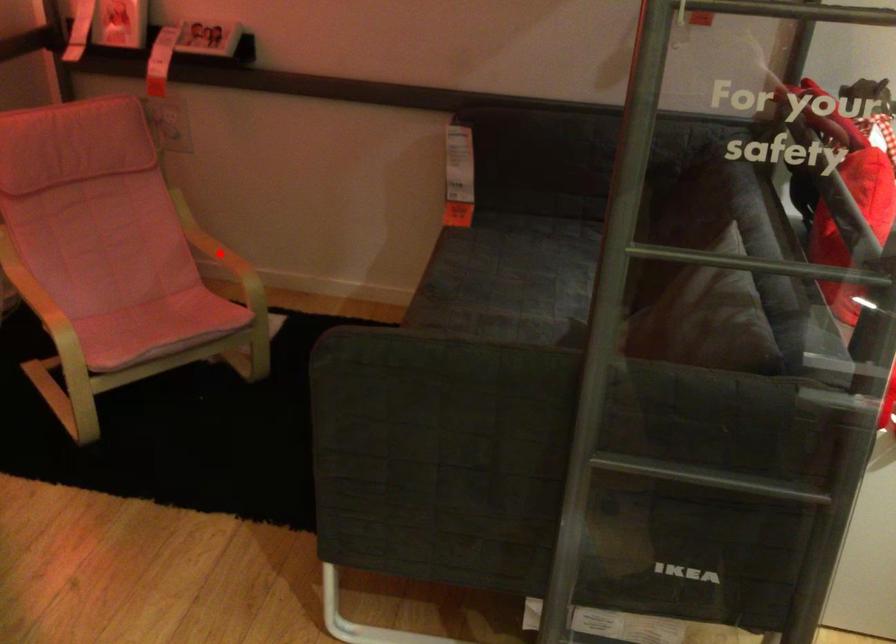
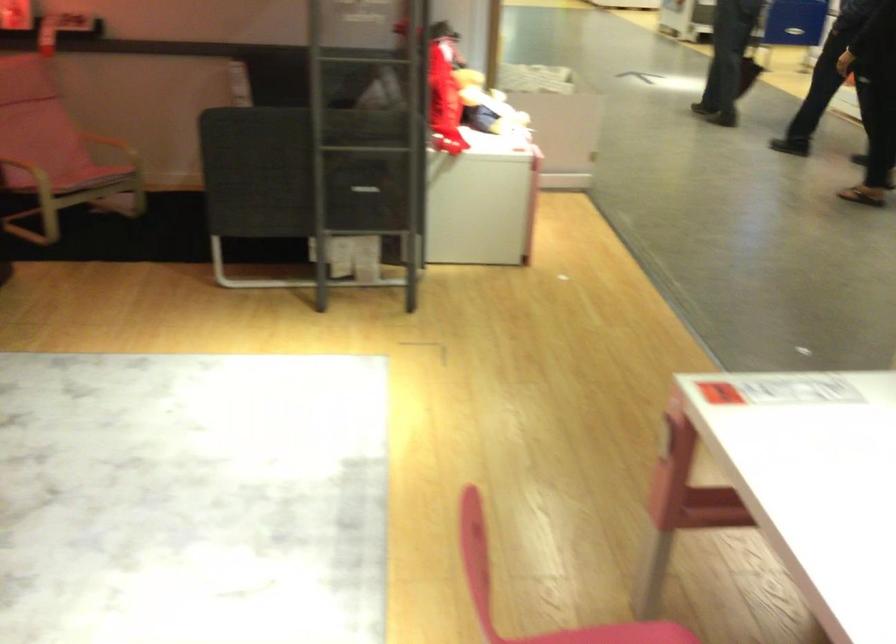
Find the pixel in the second image that matches the highlighted location in the first image.

(117, 131)